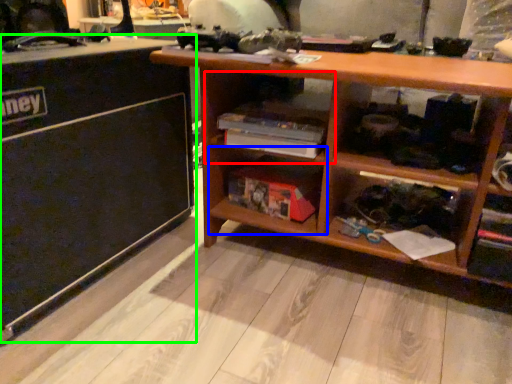
Question: Considering the real-world distances, which object is closest to cabinet (highlighted by a red box)? shelf (highlighted by a blue box) or table (highlighted by a green box).

Choices:
 (A) shelf
 (B) table

Answer: (A)